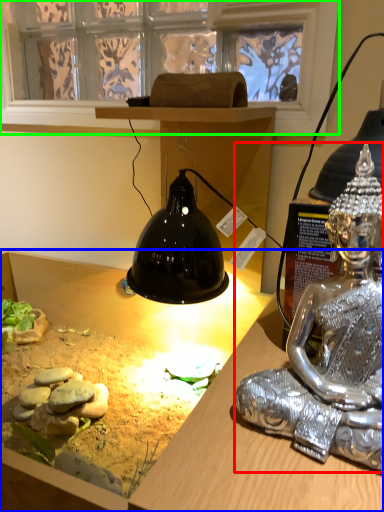
Question: Based on their relative distances, which object is nearer to person (highlighted by a red box)? Choose from desk (highlighted by a blue box) and window screen (highlighted by a green box).

Choices:
 (A) desk
 (B) window screen

Answer: (A)